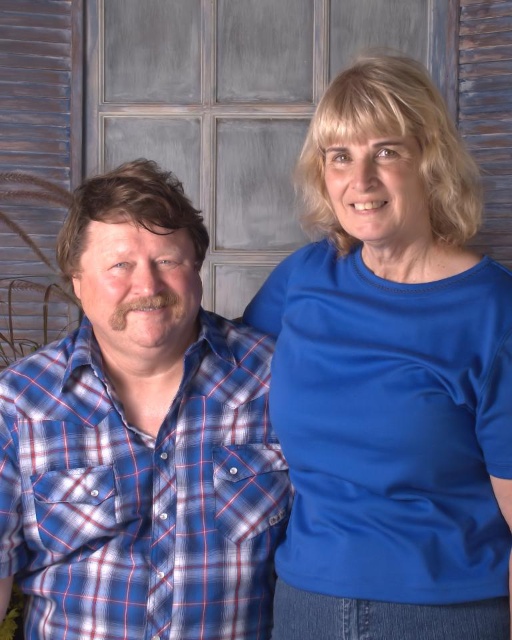
You are a photographer adjusting the lighting in the studio. You need to ensure that the blue smooth shirt at upper right is illuminated properly. Given its position at coordinates, which direction should you adjust the light source to avoid shadows on the shirt?

The blue smooth shirt at upper right is located at point (391, 378), so adjusting the light source towards the upper right direction would help illuminate it without casting shadows.

You are a photographer adjusting the lighting in the studio. You need to ensure that both the blue smooth shirt at upper right and the blue plaid shirt at left are evenly lit. Given their positions, which shirt might currently be receiving more light and why?

The blue smooth shirt at upper right is above the blue plaid shirt at left. Since it is positioned higher, it might be receiving more light if the light source is coming from above, which is common in studio setups.

Consider the image. You are a photographer trying to adjust the lighting for a photo shoot. You need to ensure that the blue smooth shirt at upper right and the blue plaid shirt at left are both evenly lit. Given their different thicknesses, which shirt might require more light to achieve the same brightness?

The blue smooth shirt at upper right is thinner than the blue plaid shirt at left, so it might require more light to achieve the same brightness because thinner materials can be more translucent and may need additional lighting to avoid shadows or maintain even illumination.